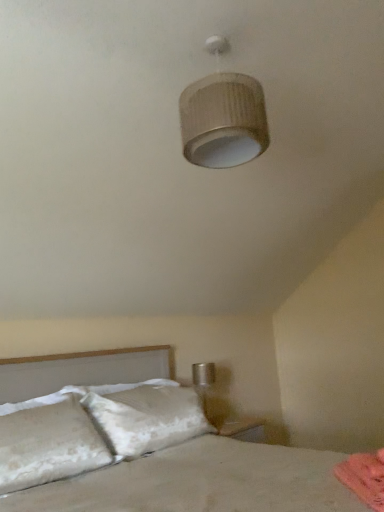
Question: Is white textured bed at lower left in front of or behind pink fabric at lower right in the image?

Choices:
 (A) front
 (B) behind

Answer: (A)

Question: From the image's perspective, is white textured bed at lower left positioned above or below pink fabric at lower right?

Choices:
 (A) above
 (B) below

Answer: (A)

Question: Which object is the closest to the white textured bed at lower left?

Choices:
 (A) matte beige lampshade at upper center
 (B) pink fabric at lower right

Answer: (B)

Question: Based on their relative distances, which object is nearer to the white textured bed at lower left?

Choices:
 (A) matte beige lampshade at upper center
 (B) pink fabric at lower right

Answer: (B)